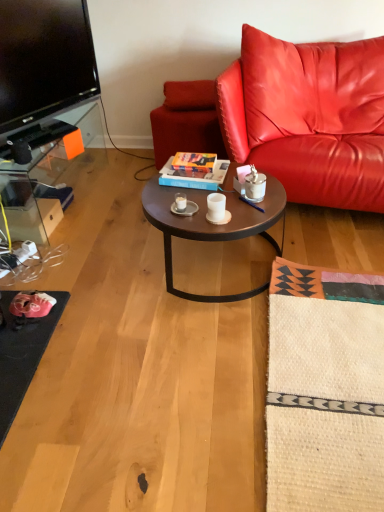
This screenshot has width=384, height=512. What are the coordinates of `free point in front of white ceramic mug at center, which is the 1th coffee cup in back-to-front order` in the screenshot? It's located at (x=192, y=218).